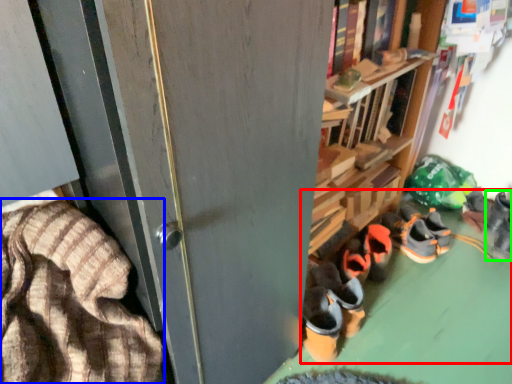
Question: Estimate the real-world distances between objects in this image. Which object is farther from footwear (highlighted by a red box), blanket (highlighted by a blue box) or footwear (highlighted by a green box)?

Choices:
 (A) blanket
 (B) footwear

Answer: (A)